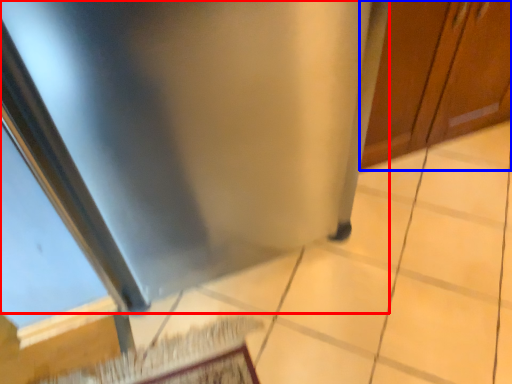
Question: Which point is closer to the camera, stainless steel (highlighted by a red box) or door (highlighted by a blue box)?

Choices:
 (A) stainless steel
 (B) door

Answer: (A)